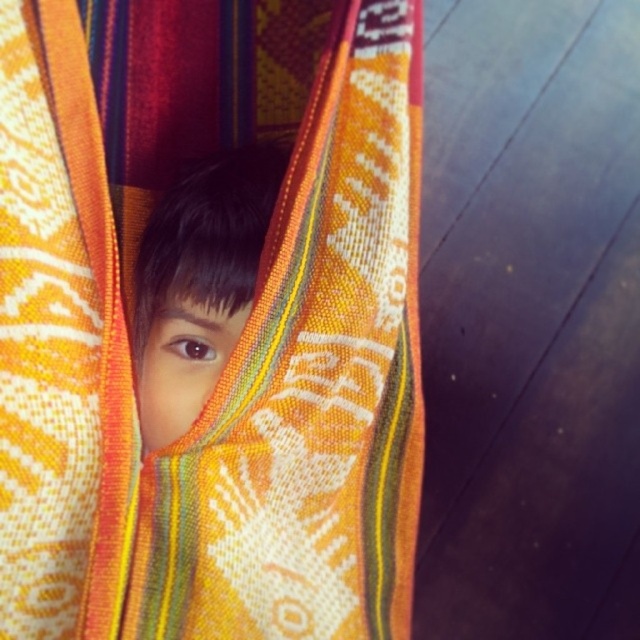
You are a photographer trying to capture a closeup of the smooth skin face at center without the textured woven fabric at center blocking it. Can you do it based on the scene?

The textured woven fabric at center is bigger than the smooth skin face at center, so it might block the face. However, since the child is only partially obscured, adjusting the angle or moving closer could allow capturing the face without obstruction.

You are a photographer trying to capture the child in the image. Since the textured woven fabric at center and the smooth skin face at center are both at the center, which object is more to the right?

The textured woven fabric at center is positioned on the right side of smooth skin face at center, so it is more to the right.